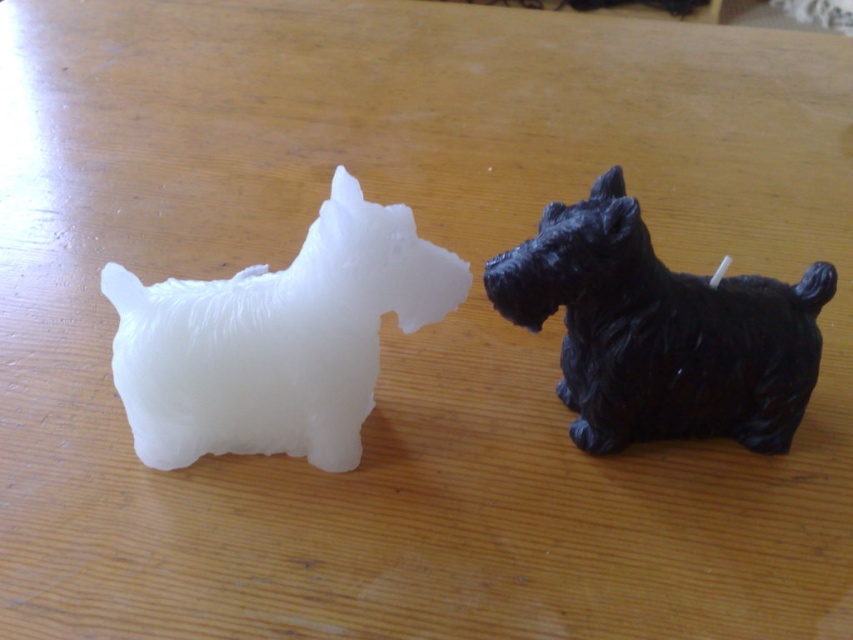
You are a collector who wants to display the white matte dog at left and the black glossy dog at right closer together. The minimum distance required between displayed items is 1 meter. Can you move them closer without violating the display rules?

The current distance between the white matte dog at left and the black glossy dog at right is 1.21 meters, which is already above the minimum required 1 meter. Therefore, you can move them closer to meet the minimum requirement without violating the display rules.

In the scene shown: Please provide the 2D coordinates of the white matte dog at left in the image.

The white matte dog at left is located at coordinates 0.531 in the x axis and 0.325 in the y axis.